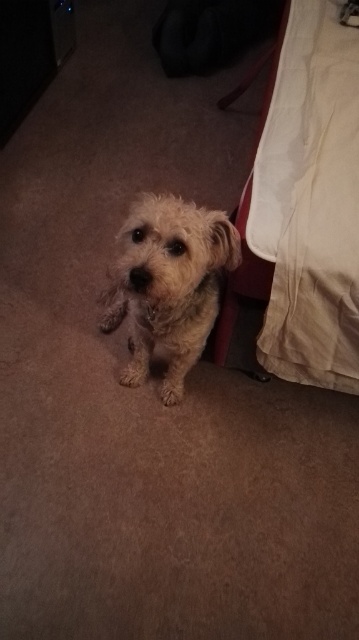
Question: Can you confirm if beige fabric bed at right is smaller than fuzzy fur dog at center?

Choices:
 (A) no
 (B) yes

Answer: (A)

Question: Is beige fabric bed at right below fuzzy fur dog at center?

Choices:
 (A) yes
 (B) no

Answer: (B)

Question: Which point is farther to the camera?

Choices:
 (A) (201, 273)
 (B) (351, 227)

Answer: (B)

Question: Is beige fabric bed at right wider than fuzzy fur dog at center?

Choices:
 (A) yes
 (B) no

Answer: (A)

Question: Among these objects, which one is nearest to the camera?

Choices:
 (A) fuzzy fur dog at center
 (B) beige fabric bed at right

Answer: (A)

Question: Among these points, which one is nearest to the camera?

Choices:
 (A) (290, 193)
 (B) (180, 278)

Answer: (B)